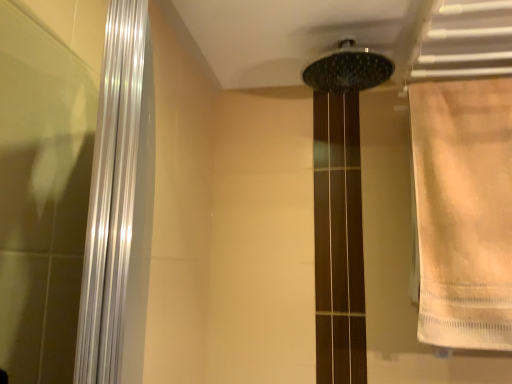
Question: Can you see beige fabric towel at right touching black matte shower head at upper center?

Choices:
 (A) no
 (B) yes

Answer: (A)

Question: Considering the relative sizes of beige fabric towel at right and black matte shower head at upper center in the image provided, is beige fabric towel at right shorter than black matte shower head at upper center?

Choices:
 (A) yes
 (B) no

Answer: (B)

Question: Is beige fabric towel at right taller than black matte shower head at upper center?

Choices:
 (A) yes
 (B) no

Answer: (A)

Question: From the image's perspective, does beige fabric towel at right appear higher than black matte shower head at upper center?

Choices:
 (A) yes
 (B) no

Answer: (B)

Question: Is beige fabric towel at right outside of black matte shower head at upper center?

Choices:
 (A) no
 (B) yes

Answer: (B)

Question: Can you confirm if beige fabric towel at right is wider than black matte shower head at upper center?

Choices:
 (A) yes
 (B) no

Answer: (B)

Question: Considering the relative positions of black matte shower head at upper center and beige fabric towel at right in the image provided, is black matte shower head at upper center to the right of beige fabric towel at right from the viewer's perspective?

Choices:
 (A) yes
 (B) no

Answer: (B)

Question: Is black matte shower head at upper center taller than beige fabric towel at right?

Choices:
 (A) no
 (B) yes

Answer: (A)

Question: Does black matte shower head at upper center appear on the left side of beige fabric towel at right?

Choices:
 (A) yes
 (B) no

Answer: (A)

Question: From a real-world perspective, is black matte shower head at upper center positioned over beige fabric towel at right based on gravity?

Choices:
 (A) no
 (B) yes

Answer: (B)

Question: Does black matte shower head at upper center have a greater width compared to beige fabric towel at right?

Choices:
 (A) yes
 (B) no

Answer: (A)

Question: From a real-world perspective, is black matte shower head at upper center located beneath beige fabric towel at right?

Choices:
 (A) yes
 (B) no

Answer: (B)

Question: Is point (508, 100) closer or farther from the camera than point (329, 69)?

Choices:
 (A) farther
 (B) closer

Answer: (A)